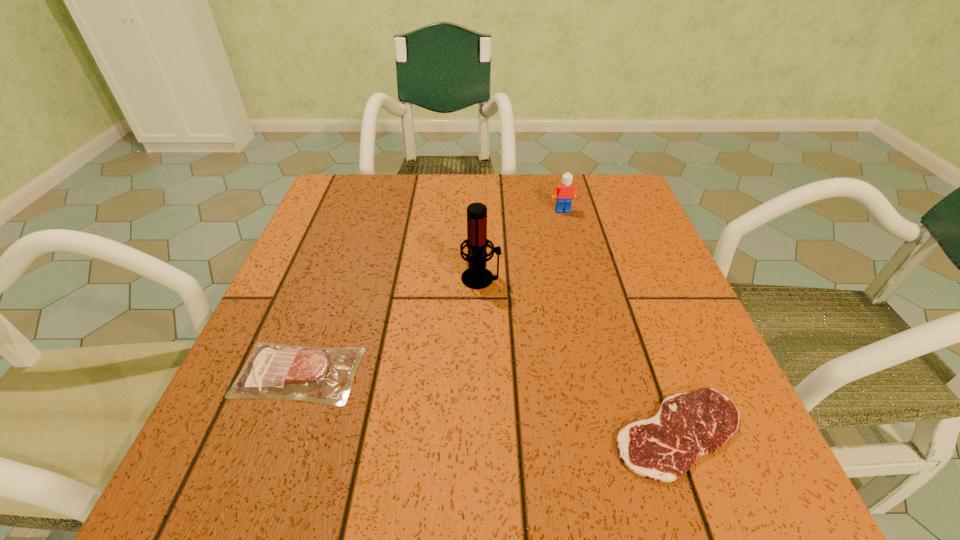
At what (x,y) coordinates should I click in order to perform the action: click on free point located on the right of the leftmost object. Please return your answer as a coordinate pair (x, y). The width and height of the screenshot is (960, 540). Looking at the image, I should click on (581, 373).

Locate an element on the screen. The width and height of the screenshot is (960, 540). blank area located on the left of the right steak is located at coordinates (549, 433).

At what (x,y) coordinates should I click in order to perform the action: click on object that is at the far edge. Please return your answer as a coordinate pair (x, y). This screenshot has width=960, height=540. Looking at the image, I should click on (565, 192).

Identify the location of object located at the near edge. This screenshot has height=540, width=960. (688, 425).

This screenshot has height=540, width=960. In order to click on object located at the left edge in this screenshot , I will do `click(323, 375)`.

Locate an element on the screen. Lego that is at the right edge is located at coordinates (565, 192).

I want to click on steak located in the right edge section of the desktop, so click(688, 425).

You are a GUI agent. You are given a task and a screenshot of the screen. Output one action in this format:
    pyautogui.click(x=<x>, y=<y>)
    Task: Click on the object at the far right corner
    This screenshot has width=960, height=540.
    Given the screenshot: What is the action you would take?
    pyautogui.click(x=565, y=192)

You are a GUI agent. You are given a task and a screenshot of the screen. Output one action in this format:
    pyautogui.click(x=<x>, y=<y>)
    Task: Click on the object positioned at the near right corner
    
    Given the screenshot: What is the action you would take?
    pyautogui.click(x=688, y=425)

Where is `vacant area at the far edge`? This screenshot has width=960, height=540. vacant area at the far edge is located at coordinates (424, 206).